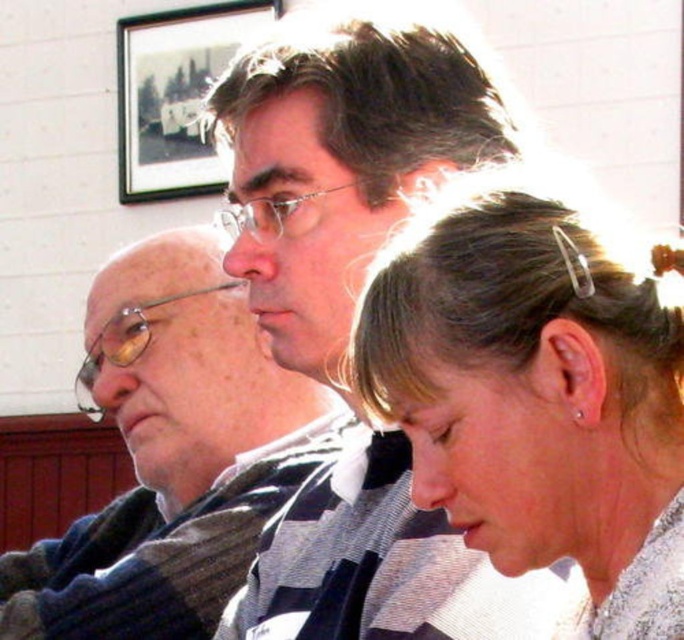
Between point (114, 394) and point (131, 188), which one is positioned in front?

Point (114, 394) is more forward.

Identify the location of matte gray scarf at left. 172,452.

The height and width of the screenshot is (640, 684). I want to click on sleek silver hair clip at upper right, so pyautogui.click(x=536, y=388).

Identify the location of sleek silver hair clip at upper right. Image resolution: width=684 pixels, height=640 pixels. (536, 388).

Is sleek silver hair clip at upper right smaller than wooden framed picture at upper center?

Correct, sleek silver hair clip at upper right occupies less space than wooden framed picture at upper center.

From the picture: Who is more forward, (607,232) or (144,88)?

Point (607,232)

Where is `sleek silver hair clip at upper right`? sleek silver hair clip at upper right is located at coordinates (536, 388).